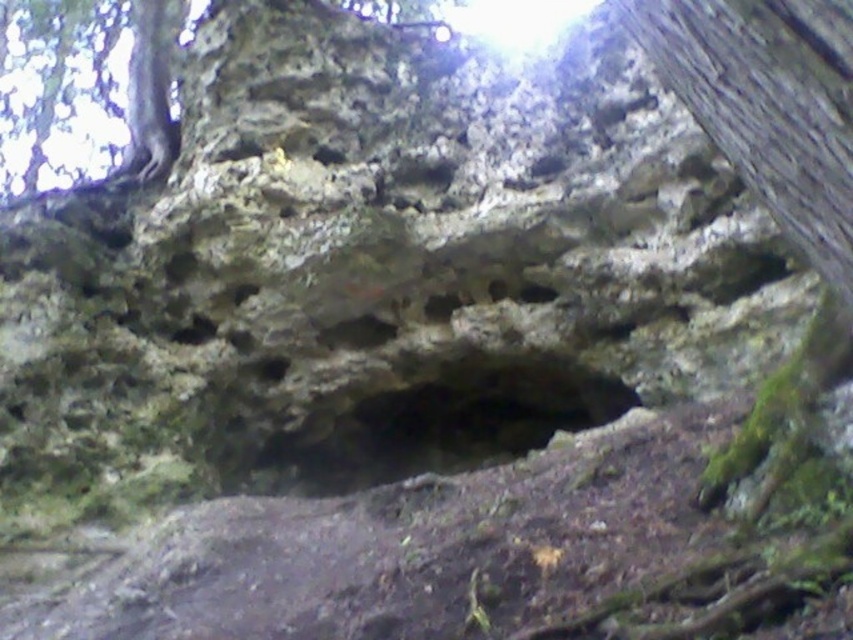
Is point (370, 369) farther from viewer compared to point (134, 138)?

No, (370, 369) is in front of (134, 138).

Does dark rock hole at center have a larger size compared to smooth bark tree trunk at upper left?

No, dark rock hole at center is not bigger than smooth bark tree trunk at upper left.

Which is in front, point (515, 392) or point (39, 64)?

Point (515, 392) is in front.

Locate an element on the screen. The image size is (853, 640). dark rock hole at center is located at coordinates (432, 420).

Is point (792, 45) farther from camera compared to point (158, 29)?

No.

Can you confirm if smooth bark tree trunk at upper right is thinner than smooth bark tree trunk at upper left?

Correct, smooth bark tree trunk at upper right's width is less than smooth bark tree trunk at upper left's.

Between point (799, 172) and point (57, 65), which one is positioned behind?

Point (57, 65)

This screenshot has width=853, height=640. I want to click on smooth bark tree trunk at upper right, so click(x=769, y=104).

Does smooth bark tree trunk at upper right have a lesser height compared to dark rock hole at center?

Correct, smooth bark tree trunk at upper right is not as tall as dark rock hole at center.

Looking at this image, can you confirm if smooth bark tree trunk at upper right is thinner than dark rock hole at center?

Correct, smooth bark tree trunk at upper right's width is less than dark rock hole at center's.

Where is `smooth bark tree trunk at upper right`? This screenshot has width=853, height=640. smooth bark tree trunk at upper right is located at coordinates (769, 104).

Locate an element on the screen. smooth bark tree trunk at upper right is located at coordinates (769, 104).